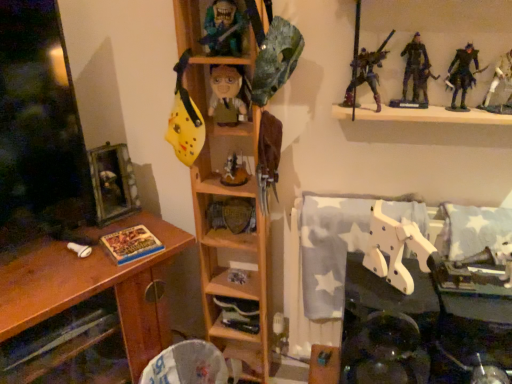
Identify the location of wooden framed picture at left. click(x=112, y=182).

Where is `wooden plaque at center, marked as the 4th shelf in a right-to-left arrangement`? Image resolution: width=512 pixels, height=384 pixels. wooden plaque at center, marked as the 4th shelf in a right-to-left arrangement is located at coordinates (231, 219).

Identify the location of fuzzy fabric doll at center, arranged as the third person when viewed from the right. The width and height of the screenshot is (512, 384). (227, 94).

This screenshot has width=512, height=384. What do you see at coordinates (367, 73) in the screenshot?
I see `metallic purple figure at upper center, placed as the 2th person when sorted from right to left` at bounding box center [367, 73].

The width and height of the screenshot is (512, 384). What do you see at coordinates (462, 75) in the screenshot? I see `dark blue fabric figure at upper right, the 3th person in the left-to-right sequence` at bounding box center [462, 75].

What is the approximate height of wooden shelf at center, which ranks as the 2th shelf in right-to-left order?

The height of wooden shelf at center, which ranks as the 2th shelf in right-to-left order, is 5.37 inches.

What do you see at coordinates (395, 249) in the screenshot? This screenshot has width=512, height=384. I see `white wood robot at lower right, which is counted as the third toy, starting from the left` at bounding box center [395, 249].

Identify the location of white wood robot at lower right, which is counted as the third toy, starting from the left. (395, 249).

Find the location of `wooden framed picture at left`. wooden framed picture at left is located at coordinates point(112,182).

Is white plastic sword at upper right, which is counted as the fifth toy, starting from the left, oriented towards dark blue fabric figure at upper right, which appears as the first person when viewed from the right?

No, white plastic sword at upper right, which is counted as the fifth toy, starting from the left, is not facing towards dark blue fabric figure at upper right, which appears as the first person when viewed from the right.

Between white plastic sword at upper right, acting as the 3th toy starting from the top, and dark blue fabric figure at upper right, which appears as the first person when viewed from the right, which one has larger size?

white plastic sword at upper right, acting as the 3th toy starting from the top, is bigger.

Consider the image. Is white plastic sword at upper right, arranged as the 1th toy when viewed from the right, outside of dark blue fabric figure at upper right, the 3th person in the left-to-right sequence?

Yes, white plastic sword at upper right, arranged as the 1th toy when viewed from the right, is located beyond the bounds of dark blue fabric figure at upper right, the 3th person in the left-to-right sequence.

From a real-world perspective, who is located lower, white plastic sword at upper right, arranged as the 1th toy when viewed from the right, or dark blue fabric figure at upper right, the 3th person in the left-to-right sequence?

white plastic sword at upper right, arranged as the 1th toy when viewed from the right, from a real-world perspective.

Does dark blue fabric figure at upper right, the 3th person in the left-to-right sequence, have a greater width compared to shiny plastic toy at upper center, the 4th toy when ordered from right to left?

Incorrect, the width of dark blue fabric figure at upper right, the 3th person in the left-to-right sequence, does not surpass that of shiny plastic toy at upper center, the 4th toy when ordered from right to left.

Does dark blue fabric figure at upper right, which appears as the first person when viewed from the right, have a lesser height compared to shiny plastic toy at upper center, which is the fifth toy in bottom-to-top order?

→ No, dark blue fabric figure at upper right, which appears as the first person when viewed from the right, is not shorter than shiny plastic toy at upper center, which is the fifth toy in bottom-to-top order.

From the image's perspective, is dark blue fabric figure at upper right, which appears as the first person when viewed from the right, on shiny plastic toy at upper center, positioned as the 1th toy in top-to-bottom order?

Incorrect, from the image's perspective, dark blue fabric figure at upper right, which appears as the first person when viewed from the right, is lower than shiny plastic toy at upper center, positioned as the 1th toy in top-to-bottom order.

Considering the relative sizes of metallic action figures at upper right, which is counted as the 1th shelf, starting from the right, and wooden shelf at center, the 3th shelf positioned from the right, in the image provided, is metallic action figures at upper right, which is counted as the 1th shelf, starting from the right, taller than wooden shelf at center, the 3th shelf positioned from the right,?

In fact, metallic action figures at upper right, which is counted as the 1th shelf, starting from the right, may be shorter than wooden shelf at center, the 3th shelf positioned from the right.

In the scene shown: From the image's perspective, does metallic action figures at upper right, which is counted as the 1th shelf, starting from the right, appear higher than wooden shelf at center, the 3th shelf positioned from the right?

Yes, from the image's perspective, metallic action figures at upper right, which is counted as the 1th shelf, starting from the right, is above wooden shelf at center, the 3th shelf positioned from the right.

In the scene shown: How distant is metallic action figures at upper right, marked as the fourth shelf in a left-to-right arrangement, from wooden shelf at center, the 3th shelf positioned from the right?

metallic action figures at upper right, marked as the fourth shelf in a left-to-right arrangement, is 20.41 inches from wooden shelf at center, the 3th shelf positioned from the right.

Considering the sizes of objects metallic action figures at upper right, marked as the fourth shelf in a left-to-right arrangement, and wooden shelf at center, which is the 2th shelf from left to right, in the image provided, who is smaller, metallic action figures at upper right, marked as the fourth shelf in a left-to-right arrangement, or wooden shelf at center, which is the 2th shelf from left to right,?

metallic action figures at upper right, marked as the fourth shelf in a left-to-right arrangement, is smaller.

From the image's perspective, is metallic purple figure at upper center, placed as the 2th person when sorted from right to left, above or below wooden plaque at center, marked as the 4th shelf in a right-to-left arrangement?

Clearly, from the image's perspective, metallic purple figure at upper center, placed as the 2th person when sorted from right to left, is above wooden plaque at center, marked as the 4th shelf in a right-to-left arrangement.

Between metallic purple figure at upper center, arranged as the second person when viewed from the left, and wooden plaque at center, acting as the 1th shelf starting from the left, which one has larger size?

Bigger between the two is metallic purple figure at upper center, arranged as the second person when viewed from the left.

There is a wooden plaque at center, acting as the 1th shelf starting from the left. At what (x,y) coordinates should I click in order to perform the action: click on the 2nd person above it (from a real-world perspective). Please return your answer as a coordinate pair (x, y). Image resolution: width=512 pixels, height=384 pixels. Looking at the image, I should click on (367, 73).

Between metallic purple figure at upper center, arranged as the second person when viewed from the left, and wooden plaque at center, acting as the 1th shelf starting from the left, which one has less height?

wooden plaque at center, acting as the 1th shelf starting from the left.

From a real-world perspective, is white wood robot at lower right, acting as the 1th toy starting from the bottom, under metallic action figures at upper right, marked as the fourth shelf in a left-to-right arrangement?

Correct, in the physical world, white wood robot at lower right, acting as the 1th toy starting from the bottom, is lower than metallic action figures at upper right, marked as the fourth shelf in a left-to-right arrangement.

Would you say metallic action figures at upper right, marked as the fourth shelf in a left-to-right arrangement, is part of white wood robot at lower right, acting as the 1th toy starting from the bottom,'s contents?

Definitely not — metallic action figures at upper right, marked as the fourth shelf in a left-to-right arrangement, is not inside white wood robot at lower right, acting as the 1th toy starting from the bottom.

Between white wood robot at lower right, arranged as the fifth toy when viewed from the top, and metallic action figures at upper right, marked as the fourth shelf in a left-to-right arrangement, which one appears on the left side from the viewer's perspective?

white wood robot at lower right, arranged as the fifth toy when viewed from the top, is more to the left.

Is white wood robot at lower right, arranged as the fifth toy when viewed from the top, aimed at metallic action figures at upper right, marked as the fourth shelf in a left-to-right arrangement?

No, white wood robot at lower right, arranged as the fifth toy when viewed from the top, is not facing towards metallic action figures at upper right, marked as the fourth shelf in a left-to-right arrangement.

Is shiny plastic toy at upper center, which is the fifth toy in bottom-to-top order, inside or outside of white wood robot at lower right, which is counted as the third toy, starting from the left?

shiny plastic toy at upper center, which is the fifth toy in bottom-to-top order, is not inside white wood robot at lower right, which is counted as the third toy, starting from the left, it's outside.

What's the angular difference between shiny plastic toy at upper center, the 4th toy when ordered from right to left, and white wood robot at lower right, arranged as the fifth toy when viewed from the top,'s facing directions?

The facing directions of shiny plastic toy at upper center, the 4th toy when ordered from right to left, and white wood robot at lower right, arranged as the fifth toy when viewed from the top, are 39.8 degrees apart.

There is a shiny plastic toy at upper center, positioned as the 1th toy in top-to-bottom order. Where is `the 4th toy below it (from a real-world perspective)`? The height and width of the screenshot is (384, 512). the 4th toy below it (from a real-world perspective) is located at coordinates (395, 249).

Between shiny plastic toy at upper center, the 2th toy from the left, and white wood robot at lower right, arranged as the fifth toy when viewed from the top, which one is positioned behind?

shiny plastic toy at upper center, the 2th toy from the left, is further from the camera.

From a real-world perspective, relative to white plastic sword at upper right, which is counted as the fifth toy, starting from the left, is fuzzy fabric doll at center, which is the first person in left-to-right order, vertically above or below?

fuzzy fabric doll at center, which is the first person in left-to-right order, is below white plastic sword at upper right, which is counted as the fifth toy, starting from the left.

Considering the sizes of objects fuzzy fabric doll at center, arranged as the third person when viewed from the right, and white plastic sword at upper right, which is the third toy in bottom-to-top order, in the image provided, who is wider, fuzzy fabric doll at center, arranged as the third person when viewed from the right, or white plastic sword at upper right, which is the third toy in bottom-to-top order,?

fuzzy fabric doll at center, arranged as the third person when viewed from the right.

Is fuzzy fabric doll at center, arranged as the third person when viewed from the right, taller than white plastic sword at upper right, acting as the 3th toy starting from the top?

Correct, fuzzy fabric doll at center, arranged as the third person when viewed from the right, is much taller as white plastic sword at upper right, acting as the 3th toy starting from the top.

Is fuzzy fabric doll at center, arranged as the third person when viewed from the right, far from white plastic sword at upper right, arranged as the 1th toy when viewed from the right?

No.

You are a GUI agent. You are given a task and a screenshot of the screen. Output one action in this format:
    pyautogui.click(x=<x>, y=<y>)
    Task: Click on the person that is above the white plastic sword at upper right, which is counted as the fifth toy, starting from the left (from a real-world perspective)
    The height and width of the screenshot is (384, 512).
    Given the screenshot: What is the action you would take?
    pyautogui.click(x=462, y=75)

There is a shiny plastic toy at upper center, which is the fifth toy in bottom-to-top order. Identify the location of the 1st person below it (from a real-world perspective). The height and width of the screenshot is (384, 512). tap(462, 75).

Estimate the real-world distances between objects in this image. Which object is closer to metallic purple figure at upper center, placed as the 2th person when sorted from right to left, wooden shelf at center, which ranks as the 2th shelf in right-to-left order, or dark blue fabric figure at upper right, the 3th person in the left-to-right sequence?

The object closer to metallic purple figure at upper center, placed as the 2th person when sorted from right to left, is dark blue fabric figure at upper right, the 3th person in the left-to-right sequence.

Based on the photo, based on their spatial positions, is wooden plaque at center, acting as the 1th shelf starting from the left, or white wood robot at lower right, the third toy from the right, further from fuzzy fabric doll at center, which is the first person in left-to-right order?

white wood robot at lower right, the third toy from the right, is positioned further to the anchor fuzzy fabric doll at center, which is the first person in left-to-right order.

When comparing their distances from metallic action figures at upper right, marked as the fourth shelf in a left-to-right arrangement, does white wood robot at lower right, acting as the 1th toy starting from the bottom, or brown wood desk at left seem closer?

Based on the image, white wood robot at lower right, acting as the 1th toy starting from the bottom, appears to be nearer to metallic action figures at upper right, marked as the fourth shelf in a left-to-right arrangement.

Which object lies nearer to the anchor point shiny plastic toy at upper center, positioned as the 1th toy in top-to-bottom order, dark gray plastic figure at upper right, which appears as the second toy when viewed from the top, or brown wood desk at left?

dark gray plastic figure at upper right, which appears as the second toy when viewed from the top, is positioned closer to the anchor shiny plastic toy at upper center, positioned as the 1th toy in top-to-bottom order.

When comparing their distances from matte plastic figurine at center, the 5th toy when ordered from right to left, does wooden plaque at center, acting as the 1th shelf starting from the left, or dark blue fabric figure at upper right, the 3th person in the left-to-right sequence, seem further?

dark blue fabric figure at upper right, the 3th person in the left-to-right sequence, is positioned further to the anchor matte plastic figurine at center, the 5th toy when ordered from right to left.

Estimate the real-world distances between objects in this image. Which object is closer to wooden plaque at center, acting as the 1th shelf starting from the left, wooden shelf at center, the 3th shelf positioned from the right, or metallic action figures at upper right, which is counted as the 1th shelf, starting from the right?

Among the two, wooden shelf at center, the 3th shelf positioned from the right, is located nearer to wooden plaque at center, acting as the 1th shelf starting from the left.

When comparing their distances from metallic action figures at upper right, which is counted as the 1th shelf, starting from the right, does matte plastic figurine at center, which is counted as the 1th toy, starting from the left, or white wood robot at lower right, the third toy from the right, seem further?

matte plastic figurine at center, which is counted as the 1th toy, starting from the left, is further to metallic action figures at upper right, which is counted as the 1th shelf, starting from the right.

In the scene shown: When comparing their distances from metallic purple figure at upper center, placed as the 2th person when sorted from right to left, does shiny plastic toy at upper center, positioned as the 1th toy in top-to-bottom order, or dark gray plastic figure at upper right, which appears as the second toy when viewed from the top, seem closer?

Among the two, dark gray plastic figure at upper right, which appears as the second toy when viewed from the top, is located nearer to metallic purple figure at upper center, placed as the 2th person when sorted from right to left.

Identify the location of picture frame located between brown wood desk at left and white plastic sword at upper right, which is counted as the fifth toy, starting from the left, in the left-right direction. This screenshot has width=512, height=384. pyautogui.click(x=112, y=182).

Where is `shelf located between brown wood desk at left and wooden shelf at center, the 3th shelf positioned from the right, in the left-right direction`? shelf located between brown wood desk at left and wooden shelf at center, the 3th shelf positioned from the right, in the left-right direction is located at coordinates (231, 219).

Identify the location of person between fuzzy fabric doll at center, which is the first person in left-to-right order, and dark gray plastic figure at upper right, arranged as the fourth toy when ordered from the bottom, from left to right. click(367, 73).

This screenshot has height=384, width=512. I want to click on shelf between fuzzy fabric doll at center, which is the first person in left-to-right order, and dark blue fabric figure at upper right, the 3th person in the left-to-right sequence, so click(436, 116).